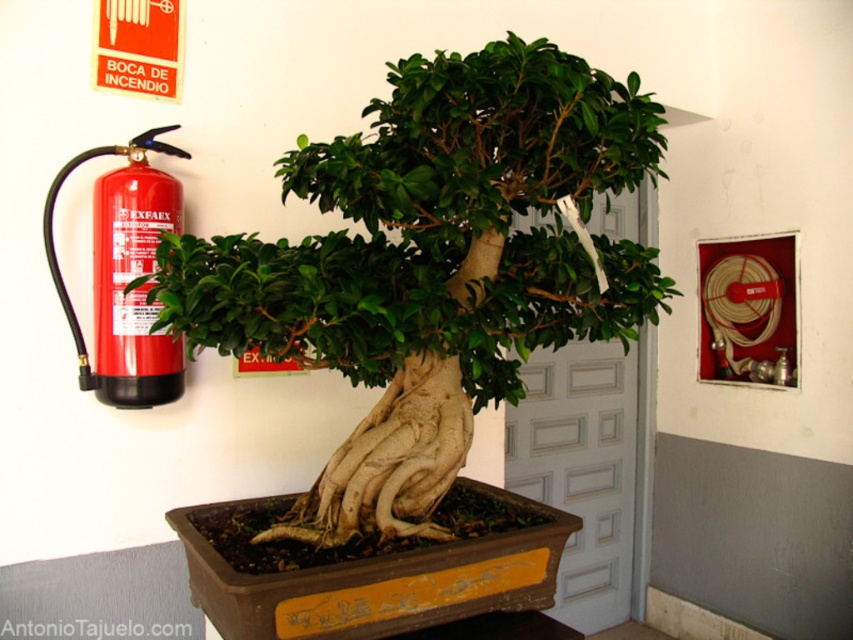
Question: Can you confirm if green matte bonsai tree at center is bigger than red matte fire extinguisher at left?

Choices:
 (A) no
 (B) yes

Answer: (B)

Question: Which point appears farthest from the camera in this image?

Choices:
 (A) (619, 108)
 (B) (135, 356)

Answer: (B)

Question: Is green matte bonsai tree at center closer to the viewer compared to red matte fire extinguisher at left?

Choices:
 (A) no
 (B) yes

Answer: (B)

Question: Among these points, which one is farthest from the camera?

Choices:
 (A) (440, 371)
 (B) (175, 372)

Answer: (B)

Question: Does green matte bonsai tree at center have a lesser width compared to red matte fire extinguisher at left?

Choices:
 (A) no
 (B) yes

Answer: (A)

Question: Which point is closer to the camera?

Choices:
 (A) red matte fire extinguisher at left
 (B) green matte bonsai tree at center

Answer: (B)